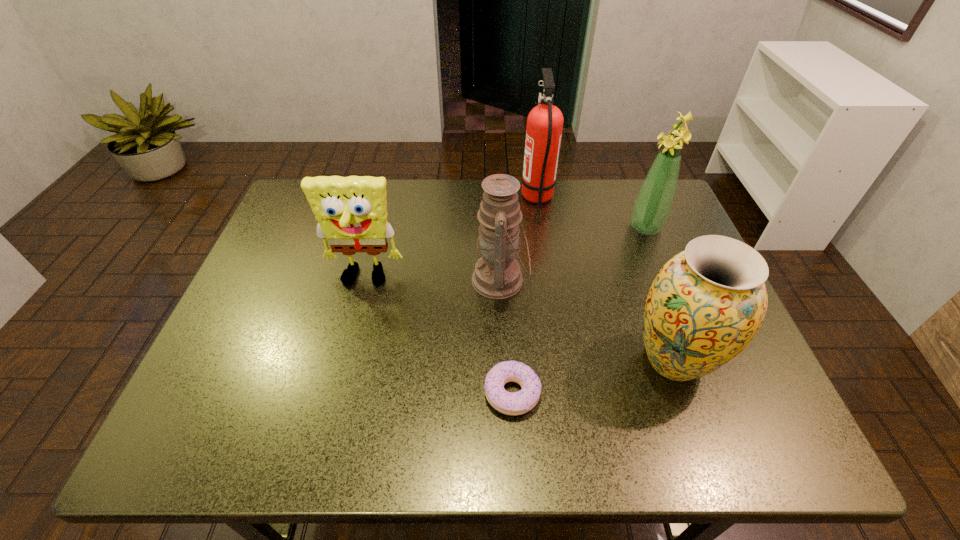
You are a GUI agent. You are given a task and a screenshot of the screen. Output one action in this format:
    pyautogui.click(x=<x>, y=<y>)
    Task: Click on the free space located on the front-facing side of the bouquet
    This screenshot has height=540, width=960.
    Given the screenshot: What is the action you would take?
    pyautogui.click(x=491, y=227)

What are the coordinates of `free space located 0.100m on the front-facing side of the bouquet` in the screenshot? It's located at (594, 227).

The image size is (960, 540). I want to click on free space located on the front-facing side of the bouquet, so click(536, 227).

In order to click on vacant area situated 0.220m on the front of the oil lamp in this screenshot , I will do `click(505, 392)`.

Where is `vacant space located 0.270m on the back of the vase`? This screenshot has width=960, height=540. vacant space located 0.270m on the back of the vase is located at coordinates (633, 247).

The image size is (960, 540). Identify the location of free point located on the face of the leftmost object. (327, 426).

Locate an element on the screen. Image resolution: width=960 pixels, height=540 pixels. vacant space situated on the back of the doughnut is located at coordinates (507, 302).

Locate an element on the screen. Image resolution: width=960 pixels, height=540 pixels. fire extinguisher at the far edge is located at coordinates (545, 121).

The height and width of the screenshot is (540, 960). I want to click on bouquet situated at the far edge, so click(652, 207).

Where is `object located at the near edge`? This screenshot has width=960, height=540. object located at the near edge is located at coordinates (517, 403).